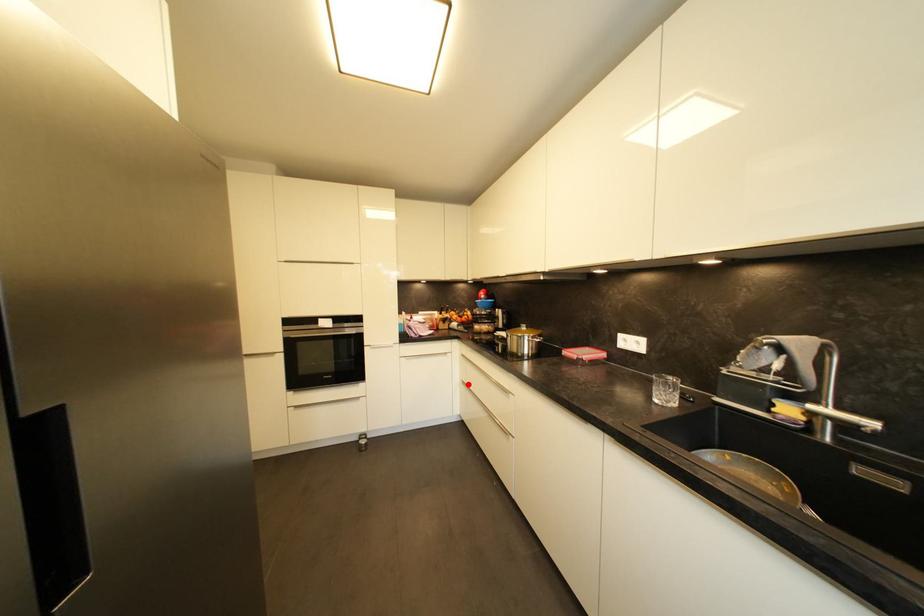
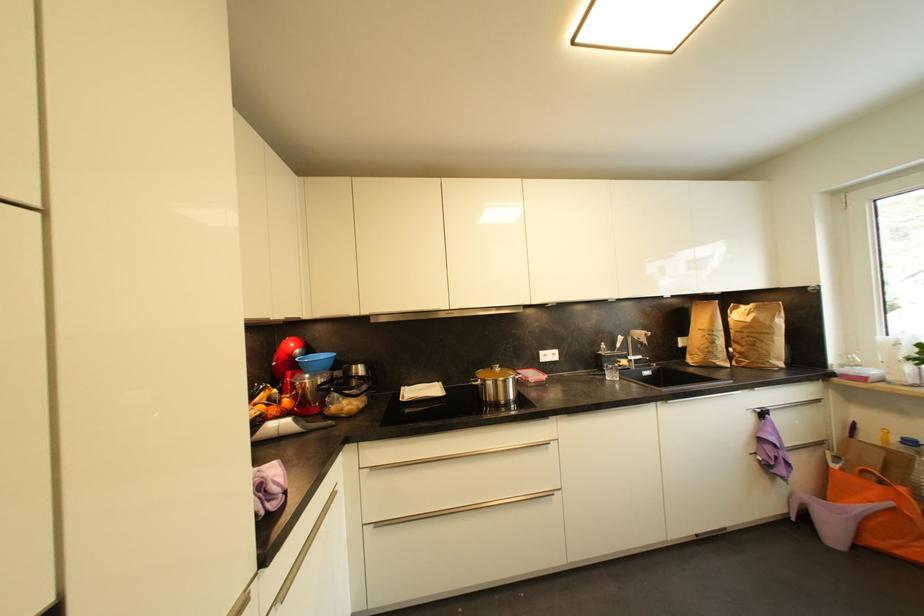
Question: A red point is marked in image1. In image2, is the corresponding 3D point closer to the camera or farther? Reply with the corresponding letter.

Choices:
 (A) The corresponding 3D point is closer.
 (B) The corresponding 3D point is farther.

Answer: (A)